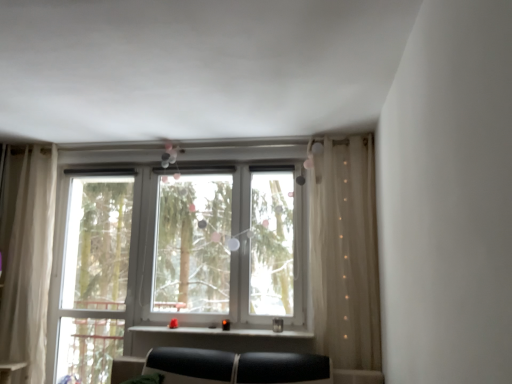
Find the location of `blank space situated above white plastic bay window at center (from a real-world perspective)`. blank space situated above white plastic bay window at center (from a real-world perspective) is located at coordinates (240, 144).